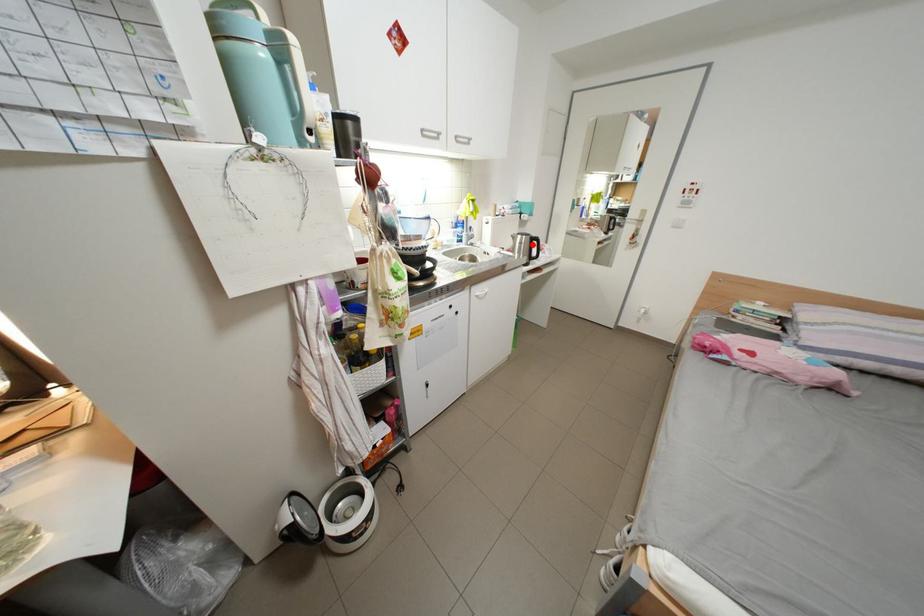
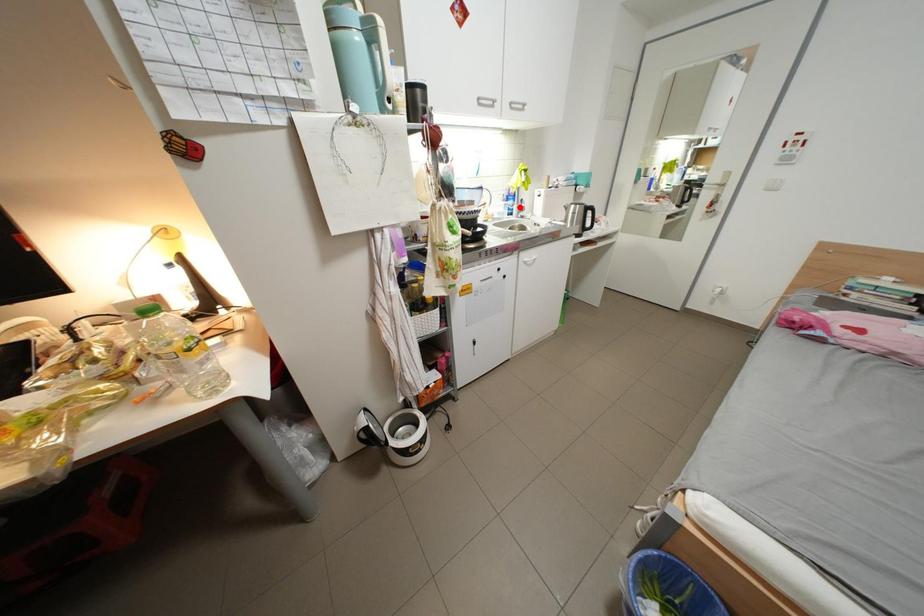
Looking at this image, I am providing you with two images of the same scene from different viewpoints. A red point is marked on the first image and another point is marked on the second image. Is the marked point in image1 the same physical position as the marked point in image2?

No